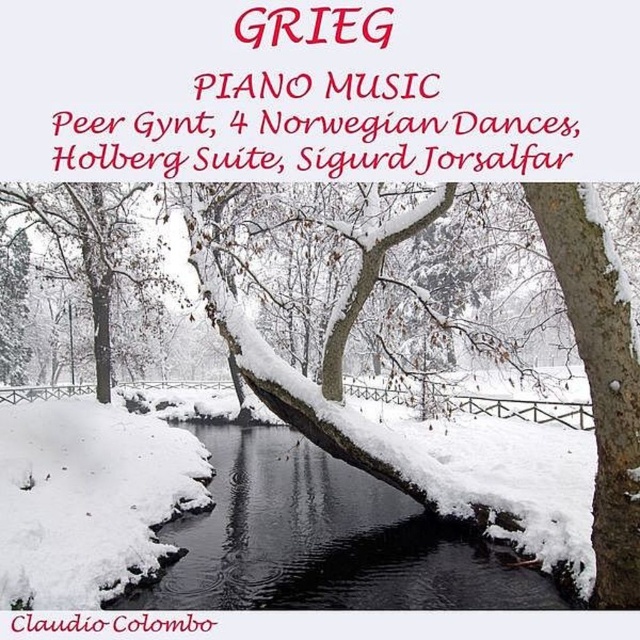
Question: Considering the relative positions of snowy stone stream at center and snow-covered bark tree at center in the image provided, where is snowy stone stream at center located with respect to snow-covered bark tree at center?

Choices:
 (A) above
 (B) below

Answer: (B)

Question: Which of the following is the farthest from the observer?

Choices:
 (A) (1, 196)
 (B) (584, 189)

Answer: (A)

Question: Which object appears closest to the camera in this image?

Choices:
 (A) snow-covered bark tree at center
 (B) white snow-covered tree at left

Answer: (A)

Question: Which point is closer to the camera?

Choices:
 (A) white snow-covered tree at left
 (B) snowy stone stream at center
 (C) snow-covered bark tree at center

Answer: (C)

Question: Is snow-covered bark tree at center bigger than white snow-covered tree at left?

Choices:
 (A) yes
 (B) no

Answer: (A)

Question: Does snowy stone stream at center lie behind snow-covered bark tree at center?

Choices:
 (A) yes
 (B) no

Answer: (A)